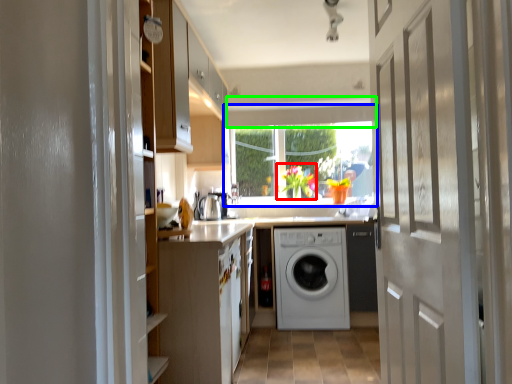
Question: Considering the real-world distances, which object is farthest from floral arrangement (highlighted by a red box)? window (highlighted by a blue box) or exhaust hood (highlighted by a green box)?

Choices:
 (A) window
 (B) exhaust hood

Answer: (B)